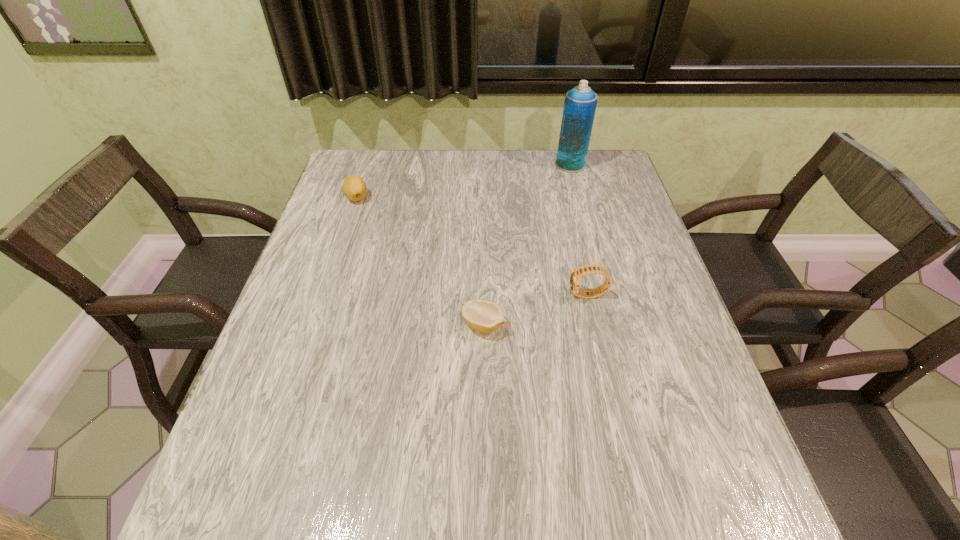
You are a GUI agent. You are given a task and a screenshot of the screen. Output one action in this format:
    pyautogui.click(x=<x>, y=<y>)
    Task: Click on the vacant space positioned 0.300m on the face of the second tallest object
    The height and width of the screenshot is (540, 960).
    Given the screenshot: What is the action you would take?
    pyautogui.click(x=442, y=295)

You are a GUI agent. You are given a task and a screenshot of the screen. Output one action in this format:
    pyautogui.click(x=<x>, y=<y>)
    Task: Click on the free space located on the face of the second tallest object
    
    Given the screenshot: What is the action you would take?
    pyautogui.click(x=501, y=295)

The image size is (960, 540). I want to click on free region located 0.300m at the stem end of the third tallest object, so click(x=329, y=282).

The height and width of the screenshot is (540, 960). I want to click on free space located on the front of the third object from right to left, so click(x=485, y=441).

Find the location of a particular element. The height and width of the screenshot is (540, 960). aerosol can positioned at the far edge is located at coordinates click(x=580, y=102).

Where is `lemon located in the far edge section of the desktop`? The image size is (960, 540). lemon located in the far edge section of the desktop is located at coordinates coord(354,188).

Locate an element on the screen. object at the left edge is located at coordinates (354, 188).

Identify the location of aerosol can that is at the right edge. (580, 102).

Where is `watch located in the right edge section of the desktop`? The image size is (960, 540). watch located in the right edge section of the desktop is located at coordinates (575, 276).

Find the location of a particular element. The width and height of the screenshot is (960, 540). object that is positioned at the far left corner is located at coordinates (354, 188).